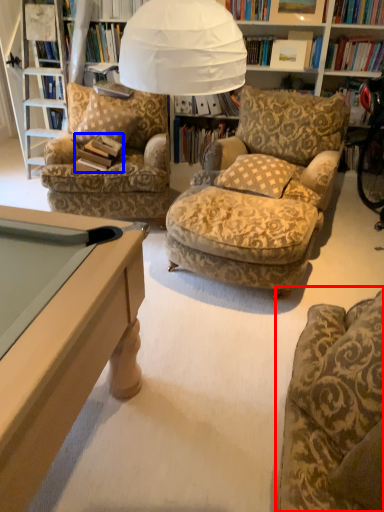
Question: Which object appears farthest to the camera in this image, chair (highlighted by a red box) or book (highlighted by a blue box)?

Choices:
 (A) chair
 (B) book

Answer: (B)